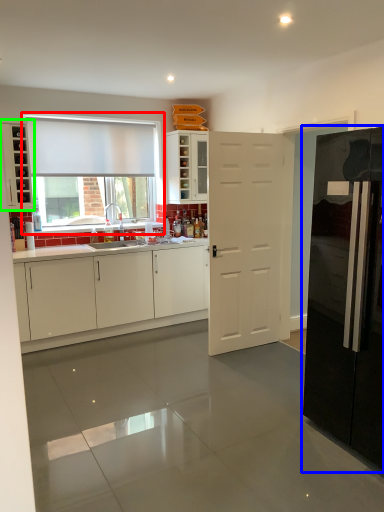
Question: Which is nearer to the window (highlighted by a red box)? refrigerator (highlighted by a blue box) or cabinetry (highlighted by a green box).

Choices:
 (A) refrigerator
 (B) cabinetry

Answer: (B)